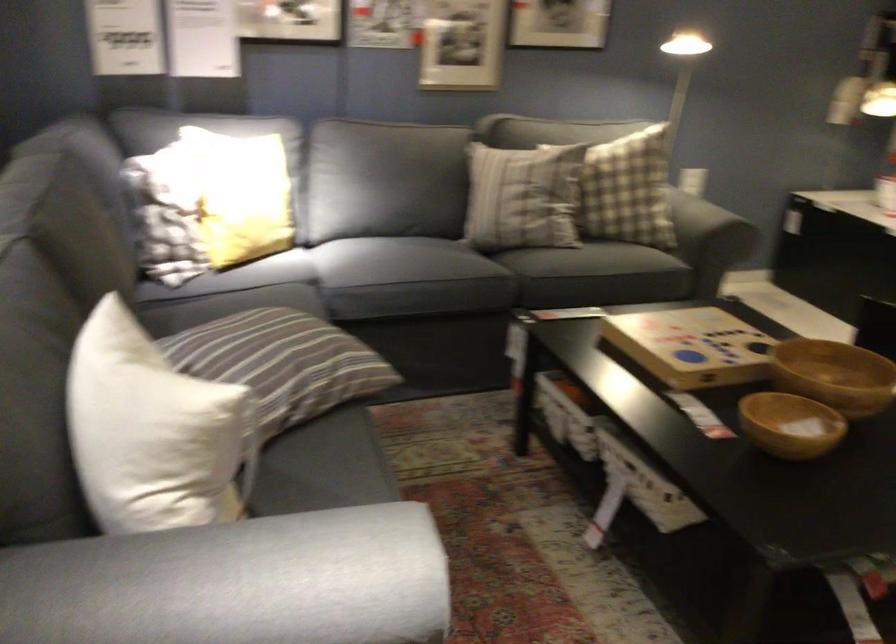
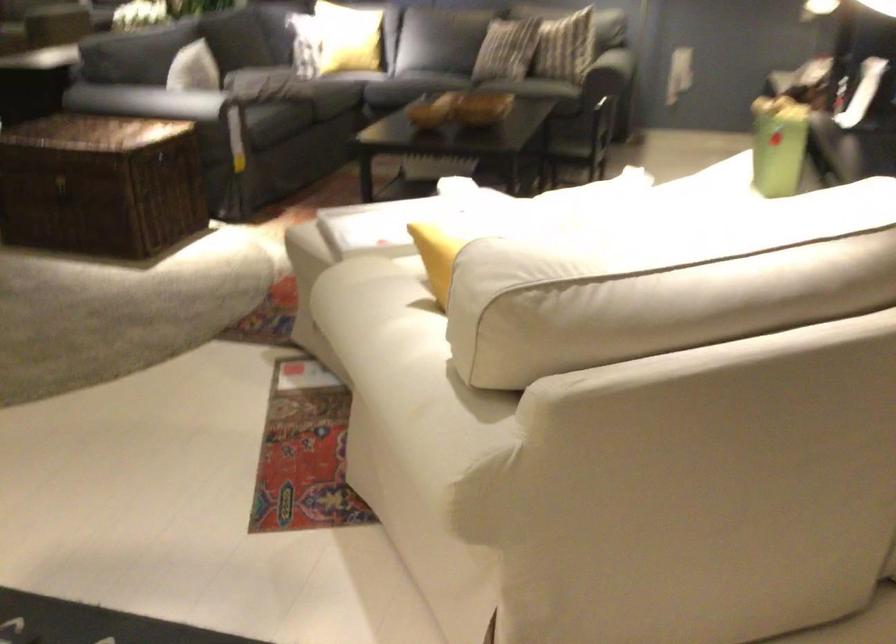
Which direction would the cameraman need to move to produce the second image?

The cameraman moved toward right, backward.